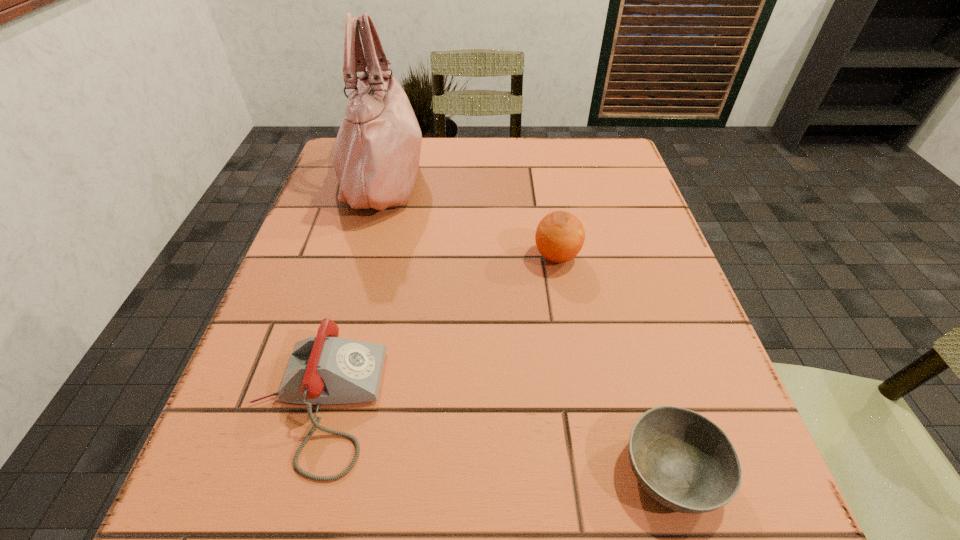
You are a GUI agent. You are given a task and a screenshot of the screen. Output one action in this format:
    pyautogui.click(x=<x>, y=<y>)
    Task: Click on the blank space that satisfies the following two spatial constraints: 1. on the front side of the shortest object; 2. on the right side of the third nearest object
    The width and height of the screenshot is (960, 540).
    Given the screenshot: What is the action you would take?
    pyautogui.click(x=594, y=470)

What are the coordinates of `vacant position in the image that satisfies the following two spatial constraints: 1. at the front of the shortest object with handles; 2. on the right side of the handbag` in the screenshot? It's located at (302, 470).

You are a GUI agent. You are given a task and a screenshot of the screen. Output one action in this format:
    pyautogui.click(x=<x>, y=<y>)
    Task: Click on the vacant space that satisfies the following two spatial constraints: 1. at the front of the orange with handles; 2. on the right side of the tallest object
    Image resolution: width=960 pixels, height=540 pixels.
    Given the screenshot: What is the action you would take?
    pyautogui.click(x=361, y=256)

Where is `free point that satisfies the following two spatial constraints: 1. at the front of the shortest object with handles; 2. on the right side of the farthest object`? This screenshot has height=540, width=960. free point that satisfies the following two spatial constraints: 1. at the front of the shortest object with handles; 2. on the right side of the farthest object is located at coordinates (302, 470).

Where is `free spot that satisfies the following two spatial constraints: 1. on the back side of the bowl; 2. on the dial of the telephone`? free spot that satisfies the following two spatial constraints: 1. on the back side of the bowl; 2. on the dial of the telephone is located at coordinates 652,403.